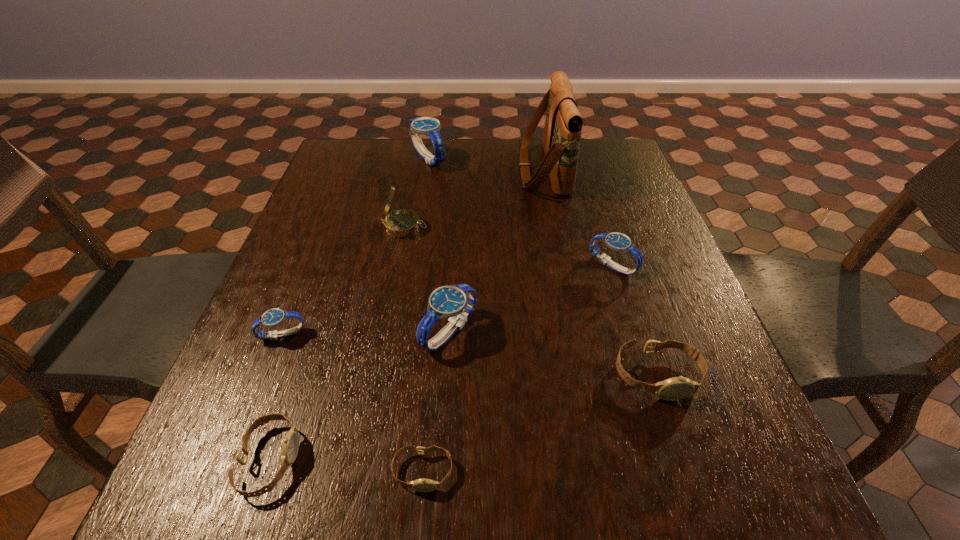
In the image, there is a desktop. What are the coordinates of `vacant space at the right edge` in the screenshot? It's located at (658, 222).

Find the location of a particular element. The height and width of the screenshot is (540, 960). vacant space at the far left corner of the desktop is located at coordinates (370, 176).

Where is `free space at the far right corner of the desktop`? The image size is (960, 540). free space at the far right corner of the desktop is located at coordinates (621, 151).

The height and width of the screenshot is (540, 960). I want to click on free space at the near right corner of the desktop, so click(x=759, y=520).

Locate an element on the screen. The height and width of the screenshot is (540, 960). free area in between the second smallest beige watch and the smallest blue watch is located at coordinates (276, 397).

What are the coordinates of `unoccupied area between the third farthest object and the leftmost beige watch` in the screenshot? It's located at (337, 343).

Locate an element on the screen. This screenshot has height=540, width=960. vacant point located between the rightmost blue watch and the biggest blue watch is located at coordinates (520, 212).

Locate an element on the screen. This screenshot has width=960, height=540. unoccupied position between the seventh nearest object and the leftmost blue watch is located at coordinates (344, 281).

The height and width of the screenshot is (540, 960). In order to click on vacant region between the second beige watch from left to right and the shoulder bag in this screenshot , I will do `click(483, 320)`.

This screenshot has height=540, width=960. I want to click on vacant space that's between the biggest beige watch and the farthest watch, so click(542, 267).